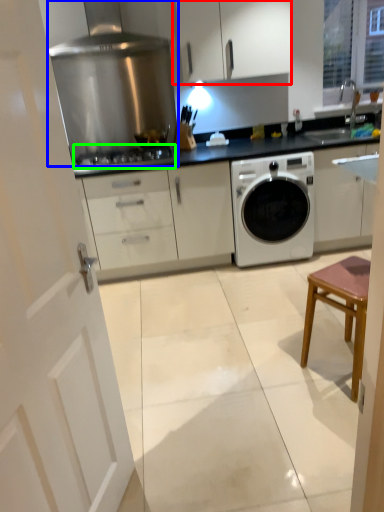
Question: Which object is positioned farthest from cabinetry (highlighted by a red box)? Select from home appliance (highlighted by a blue box) and gas stove (highlighted by a green box).

Choices:
 (A) home appliance
 (B) gas stove

Answer: (B)